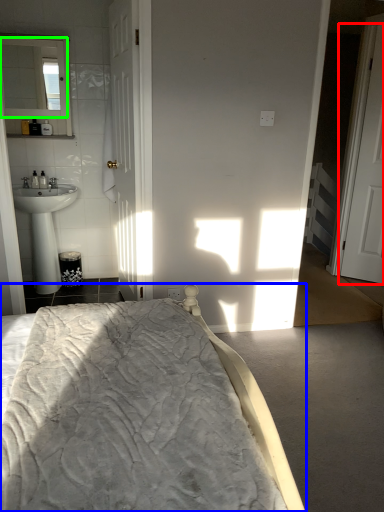
Question: Which object is the farthest from door (highlighted by a red box)? Choose among these: bed (highlighted by a blue box) or mirror (highlighted by a green box).

Choices:
 (A) bed
 (B) mirror

Answer: (A)